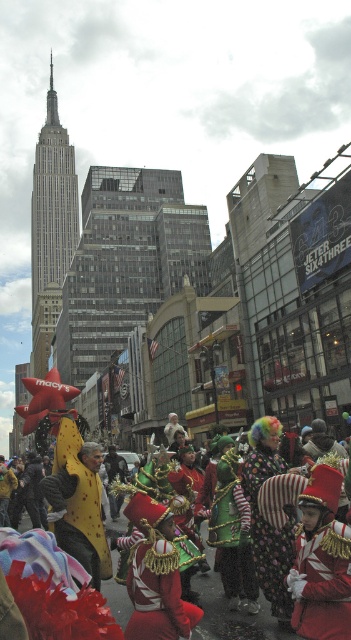
Can you confirm if yellow plush at center is smaller than shiny metallic costume at center?

Indeed, yellow plush at center has a smaller size compared to shiny metallic costume at center.

Is yellow plush at center to the left of shiny metallic costume at center from the viewer's perspective?

Correct, you'll find yellow plush at center to the left of shiny metallic costume at center.

Where is `yellow plush at center`? This screenshot has width=351, height=640. yellow plush at center is located at coordinates (77, 500).

Which is below, yellow plush at center or striped fabric clown hat at center?

striped fabric clown hat at center is below.

Is yellow plush at center smaller than striped fabric clown hat at center?

Incorrect, yellow plush at center is not smaller in size than striped fabric clown hat at center.

Where is `yellow plush at center`? Image resolution: width=351 pixels, height=640 pixels. yellow plush at center is located at coordinates (77, 500).

Does shiny red uniform at center have a lesser width compared to yellow plush at center?

Correct, shiny red uniform at center's width is less than yellow plush at center's.

Is point (307, 525) less distant than point (80, 474)?

Yes, it is in front of point (80, 474).

You are a GUI agent. You are given a task and a screenshot of the screen. Output one action in this format:
    pyautogui.click(x=<x>, y=<y>)
    Task: Click on the shiny red uniform at center
    
    Given the screenshot: What is the action you would take?
    pyautogui.click(x=321, y=561)